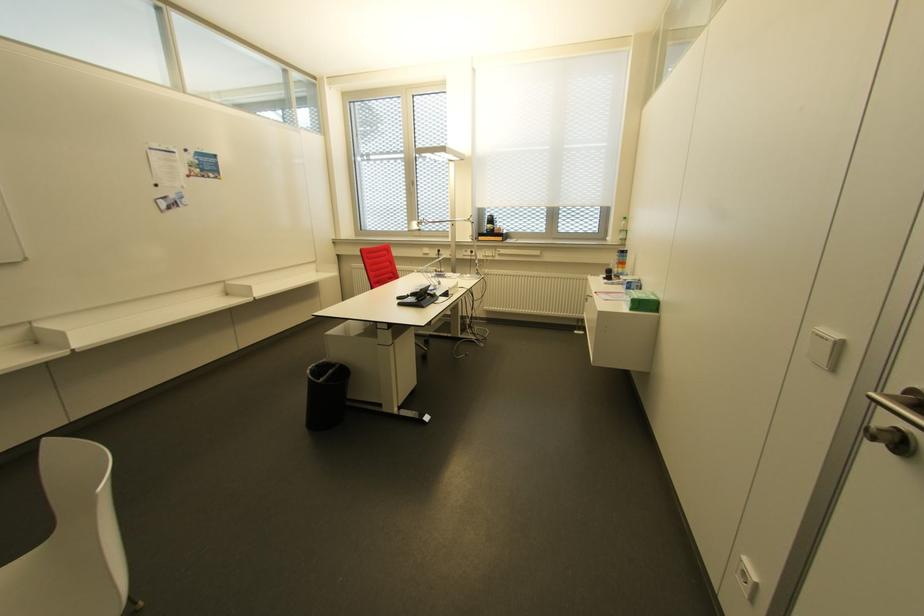
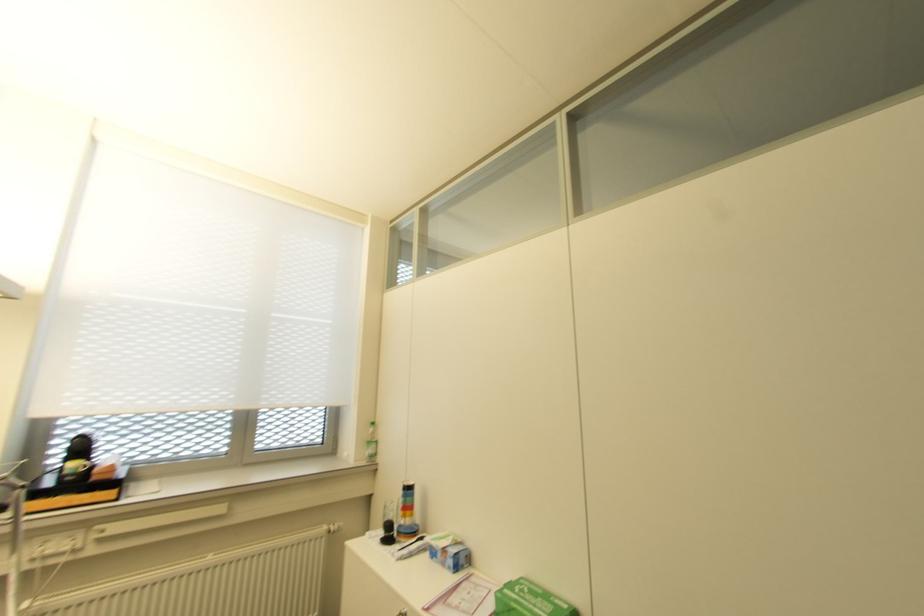
Locate, in the second image, the point that corresponds to point (615, 267) in the first image.

(402, 517)